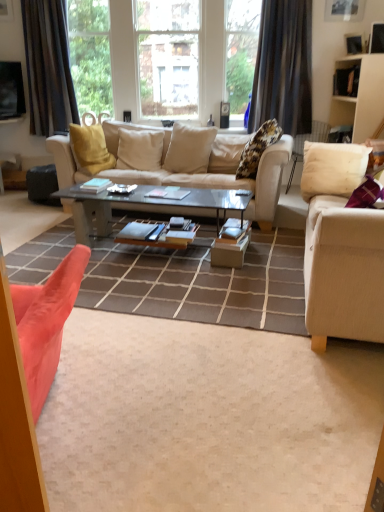
The width and height of the screenshot is (384, 512). In order to click on free space to the right of velvet orange chair at lower left in this screenshot , I will do `click(169, 422)`.